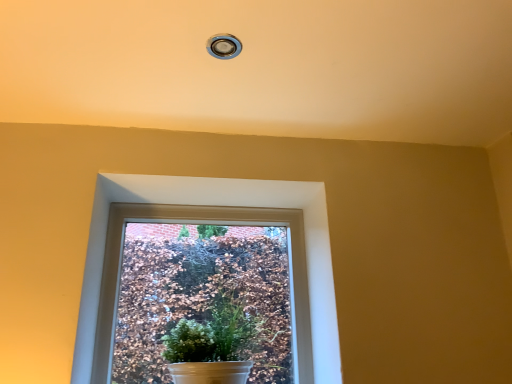
Question: Is white matte pot at center closer to the viewer compared to white glossy window at center?

Choices:
 (A) no
 (B) yes

Answer: (B)

Question: Considering the relative sizes of white matte pot at center and white glossy window at center in the image provided, is white matte pot at center taller than white glossy window at center?

Choices:
 (A) no
 (B) yes

Answer: (A)

Question: Is white glossy window at center surrounded by white matte pot at center?

Choices:
 (A) no
 (B) yes

Answer: (A)

Question: From the image's perspective, is white matte pot at center over white glossy window at center?

Choices:
 (A) no
 (B) yes

Answer: (A)

Question: Can you confirm if white matte pot at center is smaller than white glossy window at center?

Choices:
 (A) yes
 (B) no

Answer: (B)

Question: Is white matte pot at center bigger than white glossy window at center?

Choices:
 (A) yes
 (B) no

Answer: (A)

Question: From the image's perspective, is white glossy window at center beneath white matte pot at center?

Choices:
 (A) yes
 (B) no

Answer: (B)

Question: Can you confirm if white glossy window at center is positioned to the left of white matte pot at center?

Choices:
 (A) yes
 (B) no

Answer: (A)

Question: From the image's perspective, is white glossy window at center above white matte pot at center?

Choices:
 (A) yes
 (B) no

Answer: (A)

Question: Is white matte pot at center inside white glossy window at center?

Choices:
 (A) yes
 (B) no

Answer: (B)

Question: Is the position of white glossy window at center more distant than that of white matte pot at center?

Choices:
 (A) yes
 (B) no

Answer: (A)

Question: Is there a large distance between white glossy window at center and white matte pot at center?

Choices:
 (A) no
 (B) yes

Answer: (A)

Question: From a real-world perspective, is white matte pot at center positioned above or below white glossy window at center?

Choices:
 (A) below
 (B) above

Answer: (A)